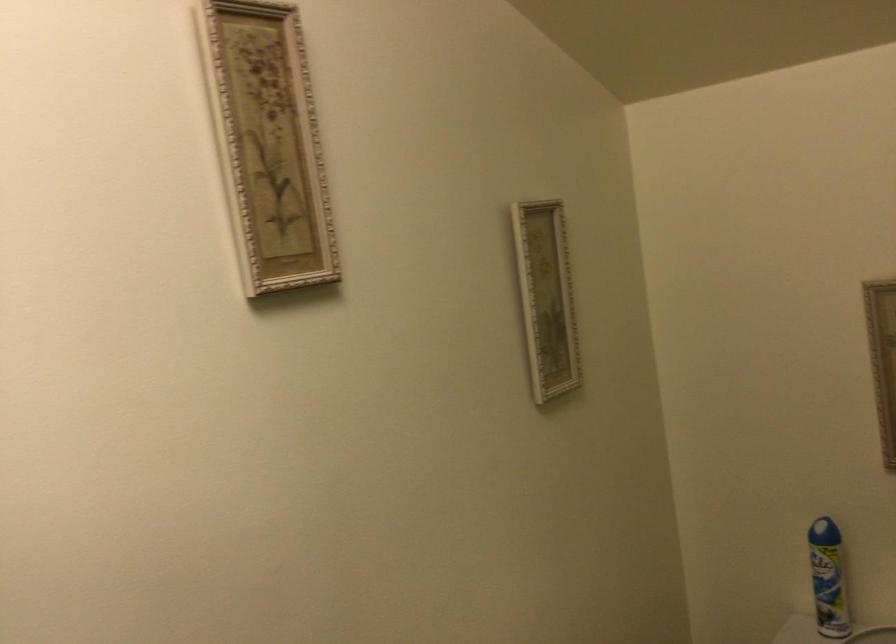
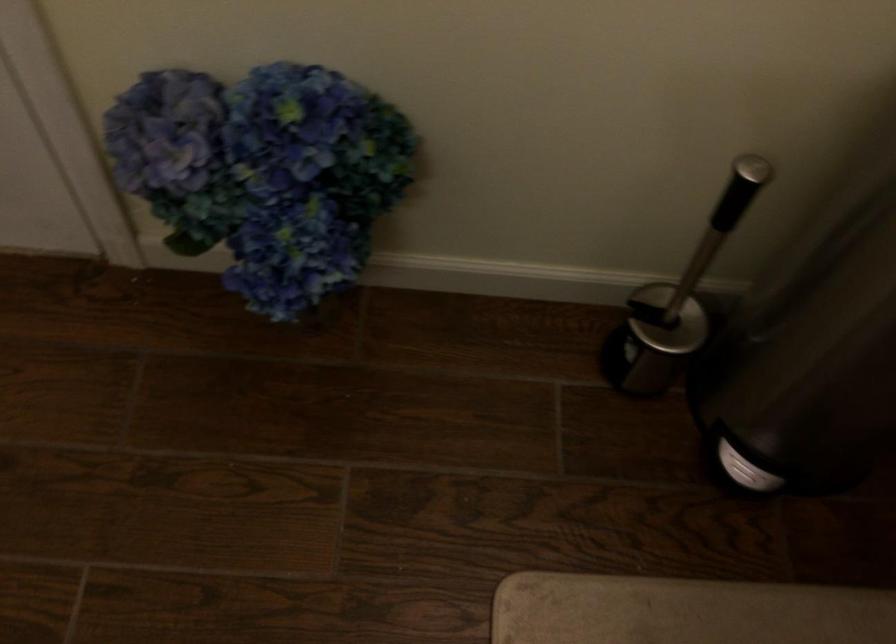
In the scene shown: How did the camera likely rotate?

The camera rotated toward left-down.